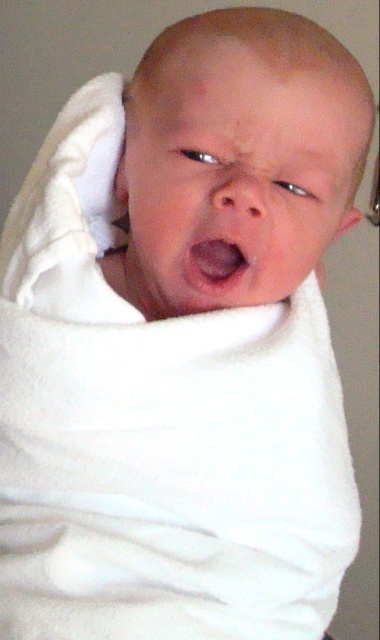
You are a pediatrician examining a newborn baby. You notice two ears on the baby, the white soft ear at upper left and the pink soft ear at upper right. Which ear is smaller in size?

The white soft ear at upper left is smaller in size compared to the pink soft ear at upper right.

You are a pediatrician examining a newborn baby. You notice the pink smooth flesh at center and the white soft ear at upper left. Which of these two body parts is larger in size?

The pink smooth flesh at center is bigger than the white soft ear at upper left, so the pink smooth flesh at center is larger in size.

You are a photographer trying to capture a closeup shot of the newborn baby. You need to ensure that both the pink smooth flesh at center and the pink soft ear at upper right are in focus. Given their sizes, which object should you prioritize focusing on to ensure it remains sharp in the photo?

The pink smooth flesh at center has a smaller width compared to the pink soft ear at upper right, so you should prioritize focusing on the pink soft ear at upper right to ensure it remains sharp in the photo.